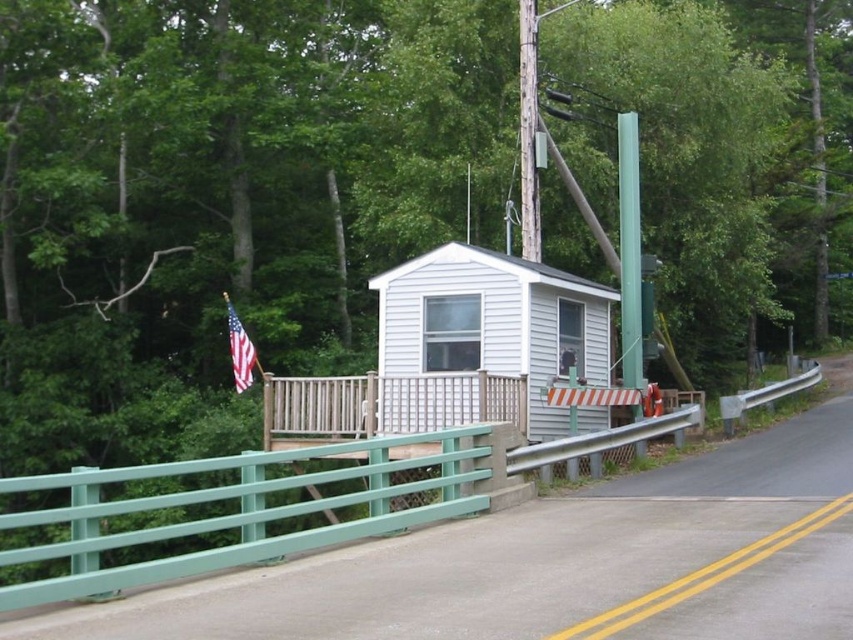
You are a painter who needs to choose between two items to paint next. You have the green painted metal fence at lower left and the weathered wood pole at upper center. Which item requires more paint if their lengths are the same?

The green painted metal fence at lower left might require more paint than the weathered wood pole at upper center if their lengths are the same because it is wider.

You are standing at the point with coordinates point (250, 371) and want to walk towards the cabin. Which direction should you move relative to point (486, 449)?

You should move towards point (486, 449) because it is in front of point (250, 371), meaning the cabin is in that direction.